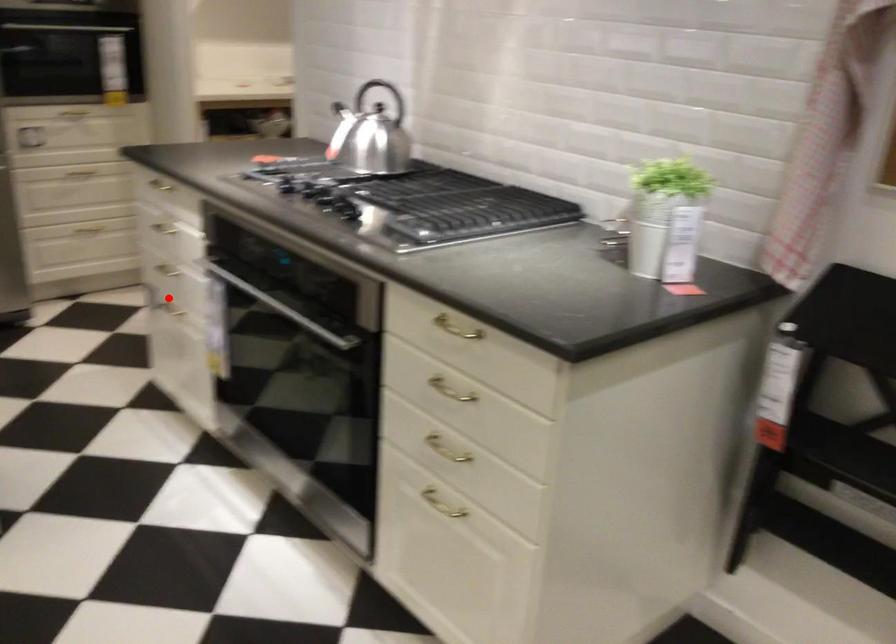
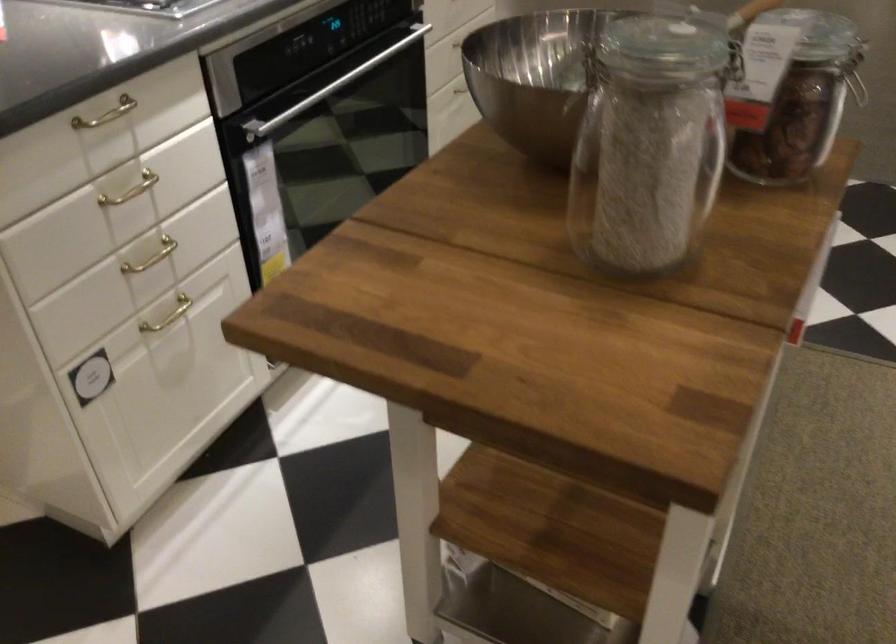
Question: I am providing you with two images of the same scene from different viewpoints. Image1 has a red point marked. In image2, the corresponding 3D location appears at what relative position? Reply with the corresponding letter.

Choices:
 (A) Closer
 (B) Farther

Answer: (A)